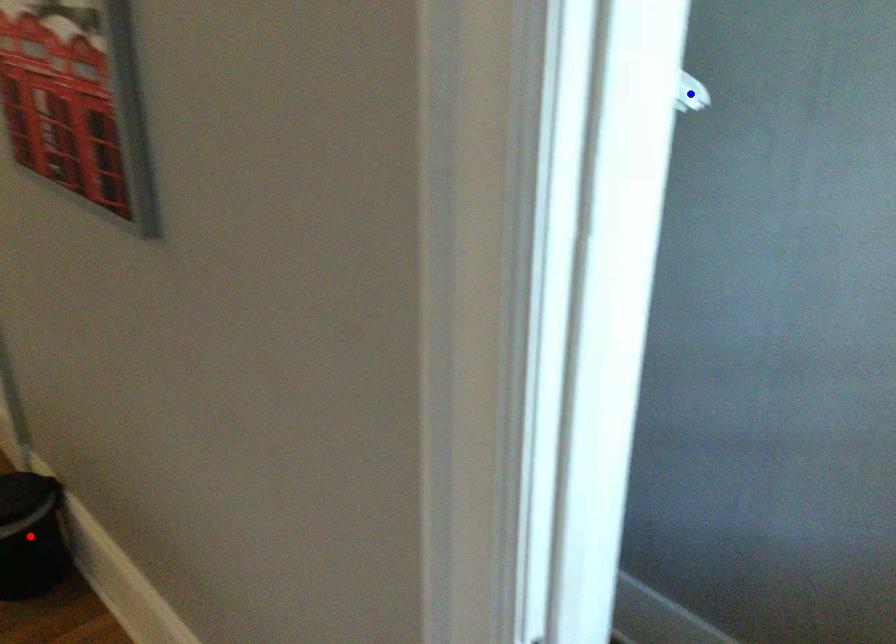
Question: Two points are marked on the image. Which point is closer to the camera?

Choices:
 (A) Blue point is closer.
 (B) Red point is closer.

Answer: (A)